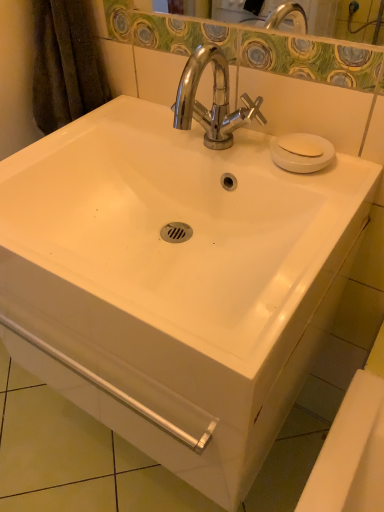
What do you see at coordinates (302, 145) in the screenshot? I see `white matte soap at upper right` at bounding box center [302, 145].

Measure the distance between white matte soap at upper right and camera.

They are 73.33 centimeters apart.

Locate an element on the screen. white matte soap at upper right is located at coordinates (302, 145).

What are the coordinates of `white matte soap at upper right` in the screenshot? It's located at (302, 145).